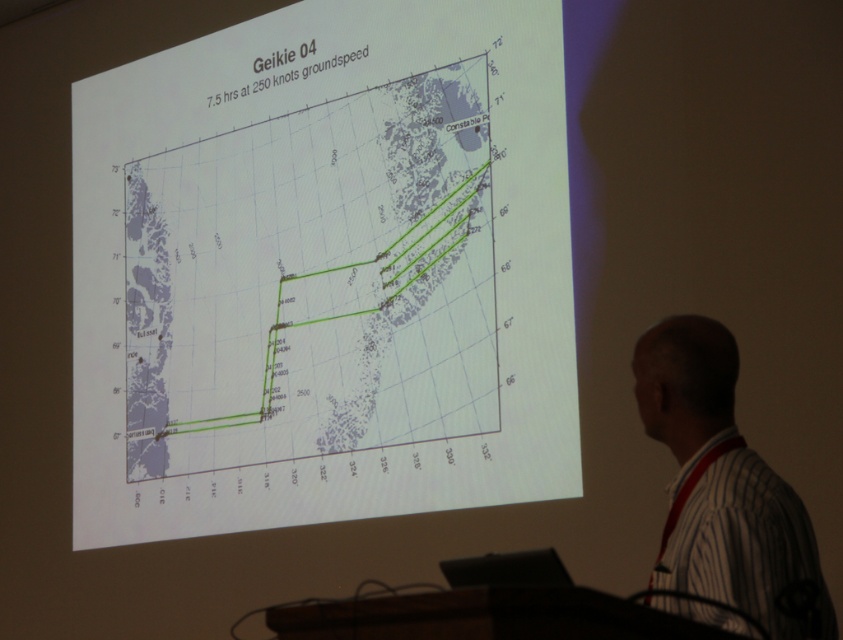
Question: Does green line graph at center have a smaller size compared to white striped shirt at right?

Choices:
 (A) yes
 (B) no

Answer: (B)

Question: Which of the following is the farthest from the observer?

Choices:
 (A) white striped shirt at right
 (B) green line graph at center

Answer: (B)

Question: Is green line graph at center above white striped shirt at right?

Choices:
 (A) no
 (B) yes

Answer: (B)

Question: Which point is closer to the camera taking this photo?

Choices:
 (A) (153, 428)
 (B) (790, 618)

Answer: (B)

Question: Is green line graph at center behind white striped shirt at right?

Choices:
 (A) no
 (B) yes

Answer: (B)

Question: Which of the following is the closest to the observer?

Choices:
 (A) green line graph at center
 (B) white striped shirt at right

Answer: (B)